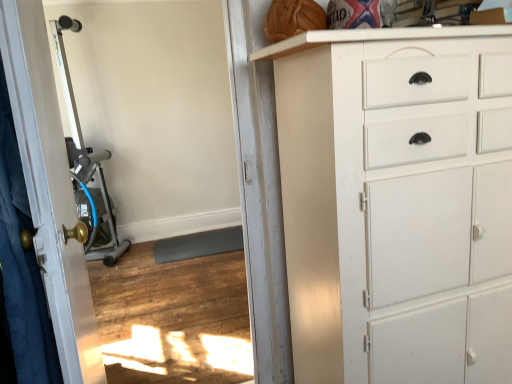
Question: From a real-world perspective, is silver metallic exercise machine at left positioned over white painted wood chest of drawers at right based on gravity?

Choices:
 (A) yes
 (B) no

Answer: (A)

Question: Does silver metallic exercise machine at left have a lesser height compared to white painted wood chest of drawers at right?

Choices:
 (A) no
 (B) yes

Answer: (A)

Question: Does silver metallic exercise machine at left touch white painted wood chest of drawers at right?

Choices:
 (A) yes
 (B) no

Answer: (B)

Question: Can you confirm if silver metallic exercise machine at left is bigger than white painted wood chest of drawers at right?

Choices:
 (A) yes
 (B) no

Answer: (B)

Question: Does silver metallic exercise machine at left come behind white painted wood chest of drawers at right?

Choices:
 (A) no
 (B) yes

Answer: (B)

Question: Is silver metallic exercise machine at left oriented towards white painted wood chest of drawers at right?

Choices:
 (A) yes
 (B) no

Answer: (B)

Question: Considering the relative sizes of white painted wood chest of drawers at right and white glossy door at left in the image provided, is white painted wood chest of drawers at right shorter than white glossy door at left?

Choices:
 (A) yes
 (B) no

Answer: (B)

Question: Does white painted wood chest of drawers at right appear on the left side of white glossy door at left?

Choices:
 (A) yes
 (B) no

Answer: (B)

Question: From a real-world perspective, is white painted wood chest of drawers at right positioned over white glossy door at left based on gravity?

Choices:
 (A) yes
 (B) no

Answer: (B)

Question: Is white painted wood chest of drawers at right bigger than white glossy door at left?

Choices:
 (A) no
 (B) yes

Answer: (B)

Question: Does white painted wood chest of drawers at right lie in front of white glossy door at left?

Choices:
 (A) yes
 (B) no

Answer: (B)

Question: Can you confirm if white painted wood chest of drawers at right is wider than white glossy door at left?

Choices:
 (A) no
 (B) yes

Answer: (B)

Question: Considering the relative positions of silver metallic exercise machine at left and silver metallic exercise machine at left in the image provided, is silver metallic exercise machine at left behind silver metallic exercise machine at left?

Choices:
 (A) no
 (B) yes

Answer: (A)